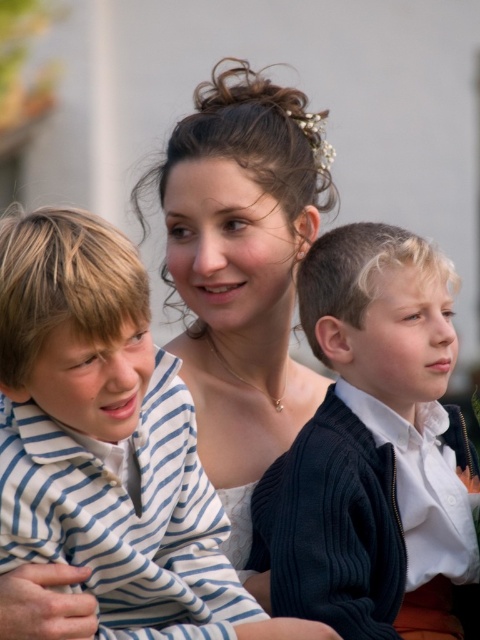
You are standing in front of the image and want to touch the two points marked as point (347,369) and point (39,276). Which point will you reach first?

Point (347,369) is further to the camera than point (39,276), so you will reach point (39,276) first because it is closer to you.

In the scene shown: You are a photographer at a wedding and need to arrange the two boys in the image so that their shirts are visible. The dark blue sweater at center and the white striped shirt at left are currently in a position where one is blocking the other. Based on their current positions, which shirt should be moved to ensure both are fully visible?

The dark blue sweater at center is positioned on the right side of the white striped shirt at left, so moving the dark blue sweater at center to the right would allow both shirts to be visible without overlapping.